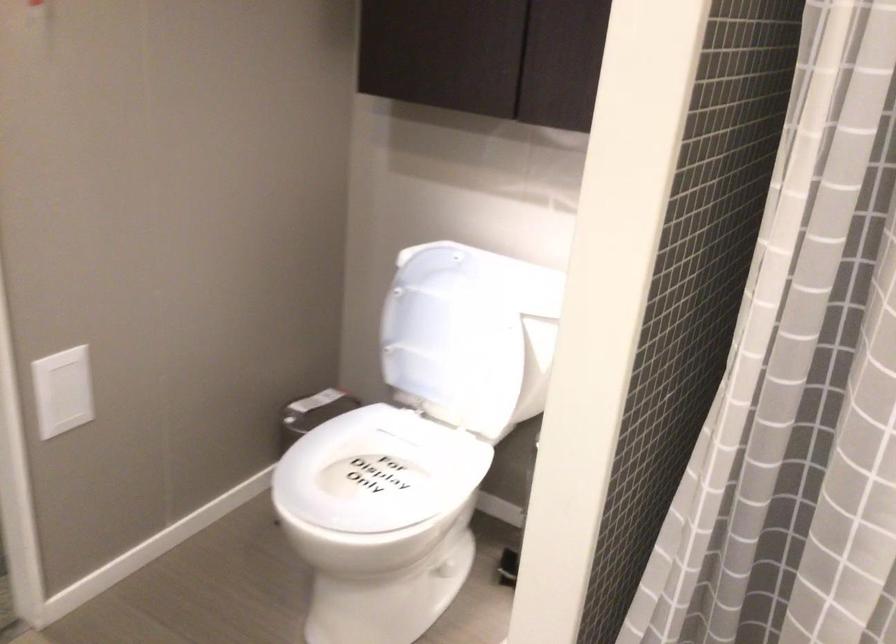
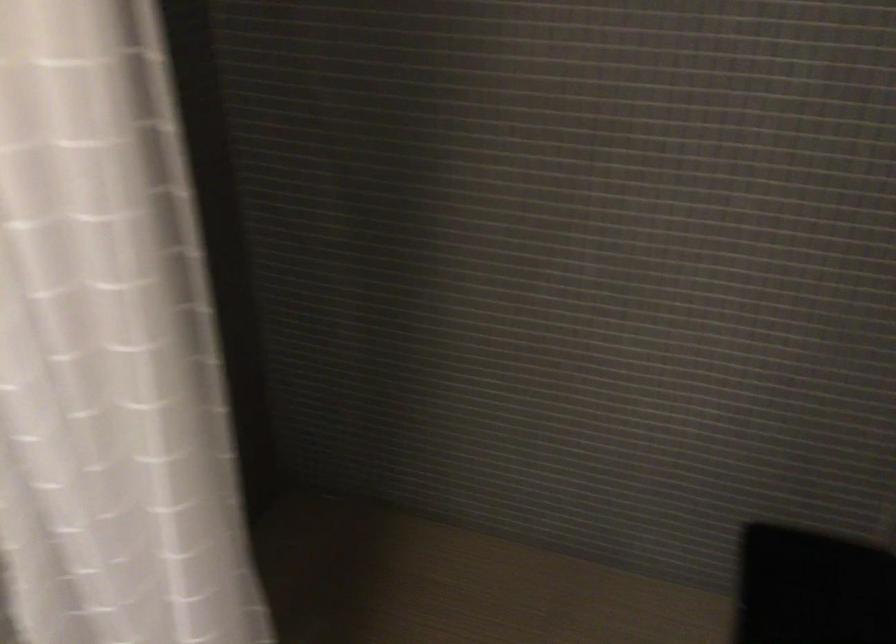
Question: The camera is either moving clockwise (left) or counter-clockwise (right) around the object. The first image is from the beginning of the video and the second image is from the end. Is the camera moving left or right when shooting the video?

Choices:
 (A) Left
 (B) Right

Answer: (A)